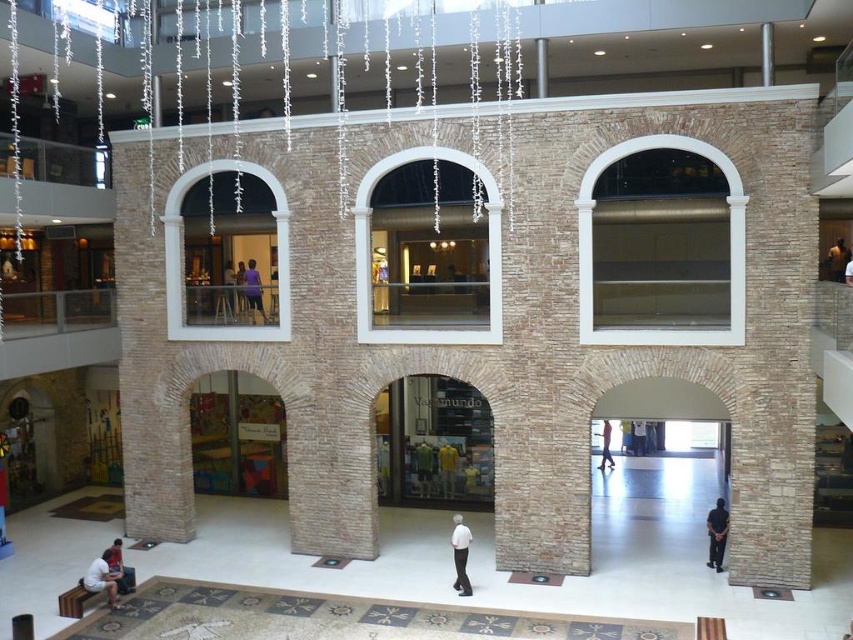
Question: Can you confirm if green jersey at center is thinner than light brown leather jacket at center?

Choices:
 (A) yes
 (B) no

Answer: (A)

Question: Can you confirm if dark brown leather jacket at upper right is thinner than light brown leather jacket at center?

Choices:
 (A) no
 (B) yes

Answer: (A)

Question: Which point is closer to the camera?

Choices:
 (A) light brown leather jacket at lower left
 (B) green jersey at center
 (C) white matte shirt at center

Answer: (A)

Question: Considering the relative positions of white matte shirt at center and light brown leather jacket at lower left in the image provided, where is white matte shirt at center located with respect to light brown leather jacket at lower left?

Choices:
 (A) left
 (B) right

Answer: (B)

Question: Which object is the closest to the purple fabric shirt at upper center?

Choices:
 (A) yellow t-shirt at center
 (B) white matte shirt at center
 (C) dark blue fabric at lower right
 (D) white brick archway at center

Answer: (D)

Question: Which object is positioned closest to the dark brown leather jacket at upper right?

Choices:
 (A) white matte shirt at center
 (B) dark blue fabric at lower right

Answer: (B)